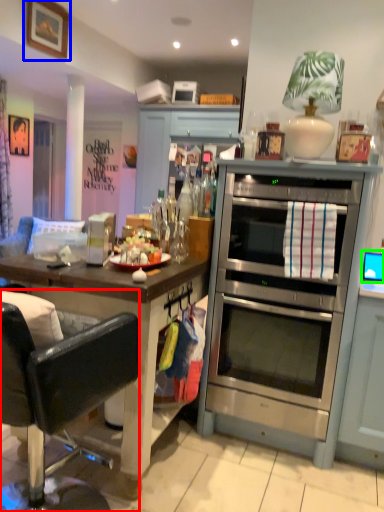
Question: Which is nearer to the chair (highlighted by a red box)? picture frame (highlighted by a blue box) or computer monitor (highlighted by a green box).

Choices:
 (A) picture frame
 (B) computer monitor

Answer: (B)